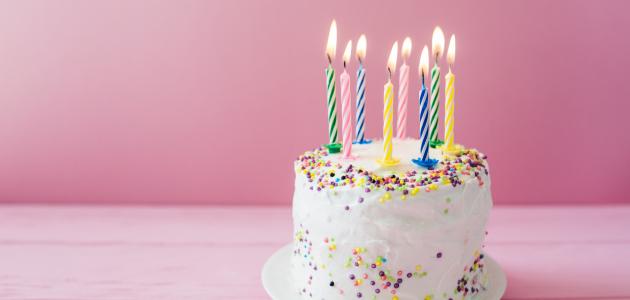
Where is `number of candles`? The image size is (630, 300). number of candles is located at coordinates (331, 108), (346, 119), (361, 95), (386, 110), (406, 100), (416, 112), (437, 101), (448, 114).